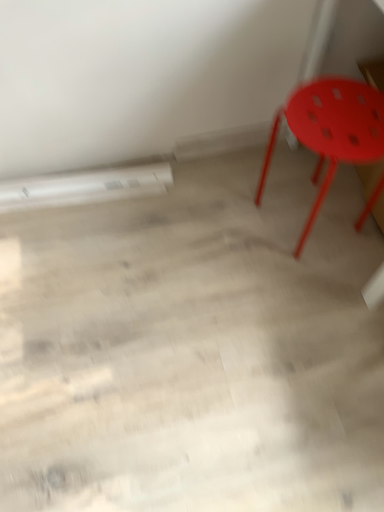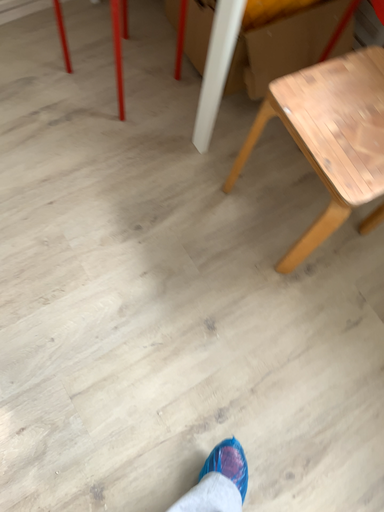
Question: Which way did the camera rotate in the video?

Choices:
 (A) rotated left
 (B) rotated right

Answer: (B)